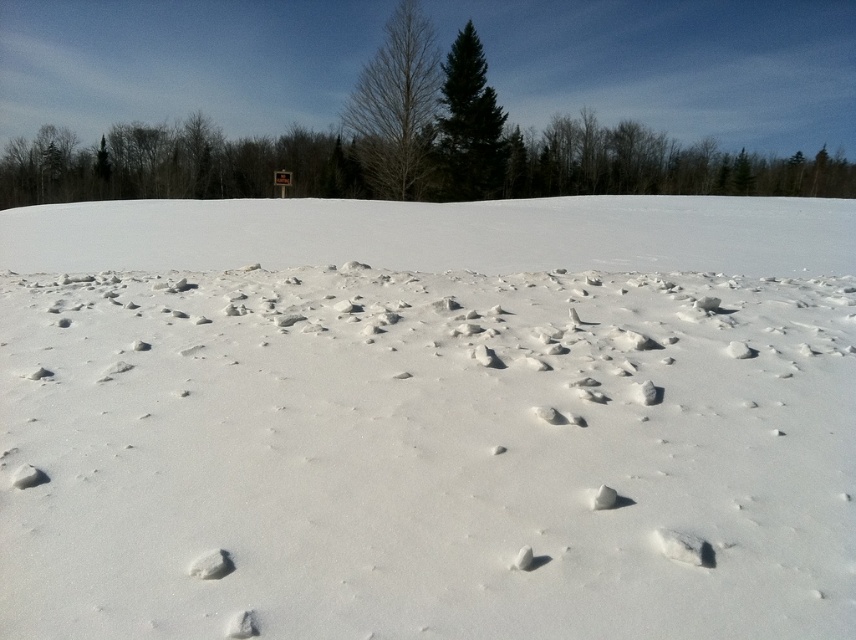
You are an outdoor photographer planning to capture the green glossy evergreen tree at center and the white matte snow at center in a single shot. Based on their positions, which object will appear closer to the camera in the photo?

The green glossy evergreen tree at center appears closer to the camera because it is positioned above the white matte snow at center, which is below it.